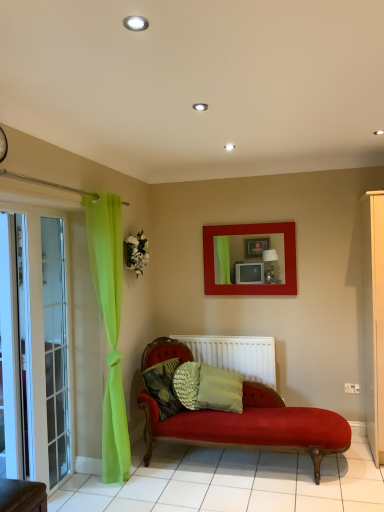
Question: Is white glass screen door at left, which is counted as the 1th screen door, starting from the front, at the left side of transparent glass screen door at left, which is the 1th screen door in back-to-front order?

Choices:
 (A) yes
 (B) no

Answer: (B)

Question: Considering the relative sizes of white glass screen door at left, which is counted as the 1th screen door, starting from the front, and transparent glass screen door at left, marked as the second screen door in a front-to-back arrangement, in the image provided, is white glass screen door at left, which is counted as the 1th screen door, starting from the front, shorter than transparent glass screen door at left, marked as the second screen door in a front-to-back arrangement,?

Choices:
 (A) no
 (B) yes

Answer: (A)

Question: Is white glass screen door at left, which is counted as the 1th screen door, starting from the front, located outside transparent glass screen door at left, which is the 1th screen door in back-to-front order?

Choices:
 (A) yes
 (B) no

Answer: (A)

Question: Are white glass screen door at left, which is counted as the 1th screen door, starting from the front, and transparent glass screen door at left, which is the 1th screen door in back-to-front order, making contact?

Choices:
 (A) no
 (B) yes

Answer: (A)

Question: Would you say white glass screen door at left, arranged as the 2th screen door when viewed from the back, contains transparent glass screen door at left, which is the 1th screen door in back-to-front order?

Choices:
 (A) yes
 (B) no

Answer: (B)

Question: Is white glass screen door at left, arranged as the 2th screen door when viewed from the back, in front of transparent glass screen door at left, marked as the second screen door in a front-to-back arrangement?

Choices:
 (A) yes
 (B) no

Answer: (A)

Question: Is white matte radiator at center to the right of textured green pillow at center from the viewer's perspective?

Choices:
 (A) no
 (B) yes

Answer: (B)

Question: From a real-world perspective, is white matte radiator at center on textured green pillow at center?

Choices:
 (A) no
 (B) yes

Answer: (B)

Question: Does white matte radiator at center have a lesser height compared to textured green pillow at center?

Choices:
 (A) no
 (B) yes

Answer: (A)

Question: Is the position of white matte radiator at center less distant than that of textured green pillow at center?

Choices:
 (A) no
 (B) yes

Answer: (A)

Question: From the image's perspective, is white matte radiator at center above textured green pillow at center?

Choices:
 (A) no
 (B) yes

Answer: (B)

Question: Is white matte radiator at center to the left of textured green pillow at center from the viewer's perspective?

Choices:
 (A) no
 (B) yes

Answer: (A)

Question: Is white glass screen door at left, which is counted as the 1th screen door, starting from the front, shorter than textured green pillow at center?

Choices:
 (A) yes
 (B) no

Answer: (B)